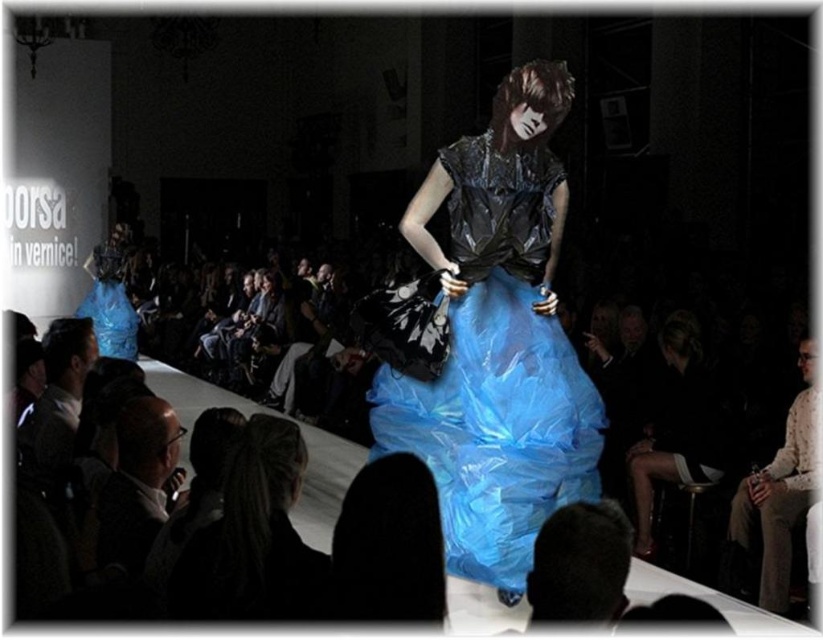
Find the location of a particular element. black satin dress at lower right is located at coordinates (677, 428).

Measure the distance between black satin dress at lower right and camera.

black satin dress at lower right is 17.65 feet away from camera.

Locate an element on the screen. black satin dress at lower right is located at coordinates (677, 428).

Who is more distant from viewer, [175,598] or [670,403]?

Positioned behind is point [670,403].

Does light blue tulle skirt at center have a greater height compared to black satin dress at lower right?

Incorrect, light blue tulle skirt at center's height is not larger of black satin dress at lower right's.

Identify the location of light blue tulle skirt at center. The height and width of the screenshot is (640, 823). (252, 538).

I want to click on light blue tulle skirt at center, so click(252, 538).

Does point (515, 275) lie in front of point (263, 442)?

No, (515, 275) is further to viewer.

Who is positioned more to the left, translucent blue fabric dress at center or light blue tulle skirt at center?

light blue tulle skirt at center

Is point (598, 484) farther from viewer compared to point (291, 614)?

Yes.

The width and height of the screenshot is (823, 640). What are the coordinates of `translucent blue fabric dress at center` in the screenshot? It's located at 496,374.